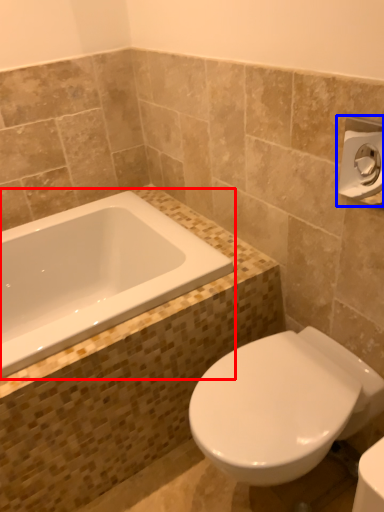
Question: Among these objects, which one is farthest to the camera, bathtub (highlighted by a red box) or towel bar (highlighted by a blue box)?

Choices:
 (A) bathtub
 (B) towel bar

Answer: (A)